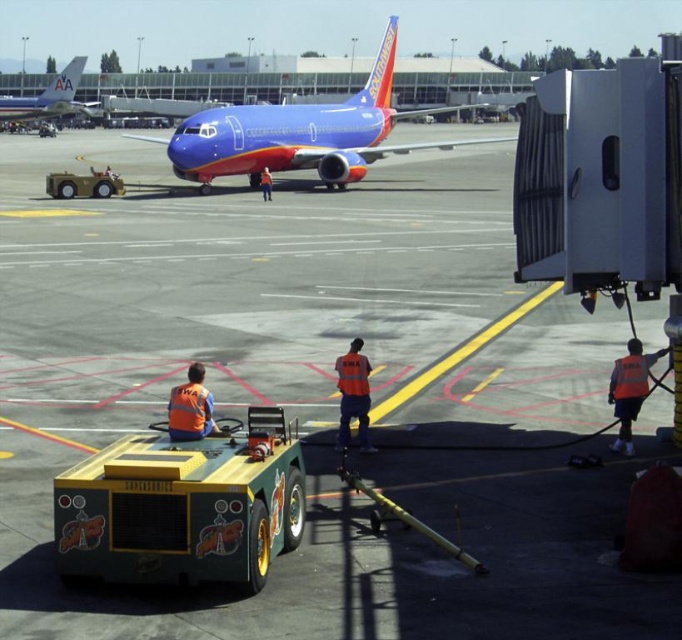
You are standing on the airport tarmac and see the blue glossy airplane at center and the blue glossy airplane at upper left. Which airplane is closer to the ground?

The blue glossy airplane at center is positioned under the blue glossy airplane at upper left, so the blue glossy airplane at center is closer to the ground.

You are a pilot standing on the tarmac and see the blue glossy airplane at center and the blue glossy airplane at upper left. Which airplane would appear larger to you?

The blue glossy airplane at center is closer to the viewer, so it would appear larger than the blue glossy airplane at upper left.

You are standing at the airport tarmac and see two points marked in the scene. The first point is at coordinates point (x=76, y=109) and the second point is at point (x=612, y=369). Which point is closer to your eyes?

Point (x=76, y=109) is closer to your eyes because it is further to the camera than point (x=612, y=369).